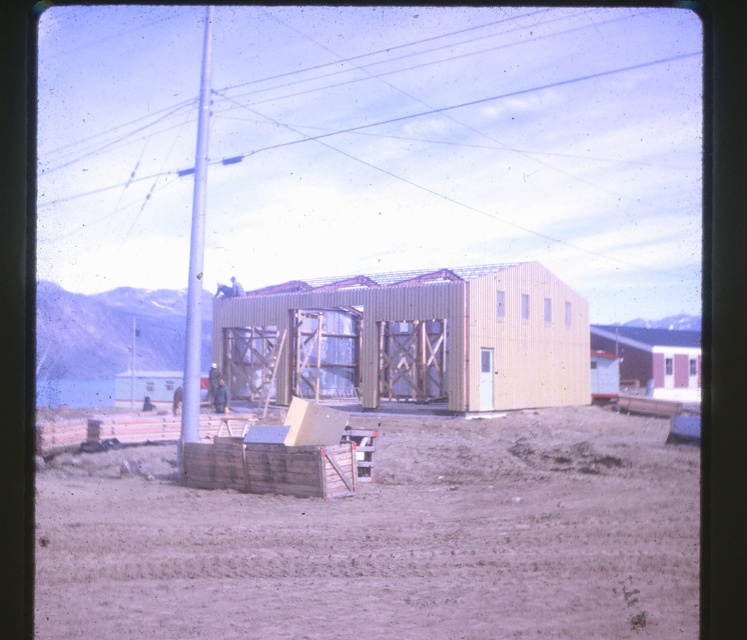
Question: Can you confirm if light brown corrugated metal hut at center is wider than metallic pole at center-left?

Choices:
 (A) no
 (B) yes

Answer: (B)

Question: Which point is closer to the camera taking this photo?

Choices:
 (A) (483, 410)
 (B) (207, 132)

Answer: (A)

Question: Which point is farther to the camera?

Choices:
 (A) brown sandy dirt at lower center
 (B) metallic pole at center-left
 (C) wooden cabin at center
 (D) light brown corrugated metal hut at center

Answer: (D)

Question: Is wooden cabin at center positioned behind light brown corrugated metal hut at center?

Choices:
 (A) yes
 (B) no

Answer: (B)

Question: Which point is closer to the camera taking this photo?

Choices:
 (A) (459, 285)
 (B) (187, 579)
 (C) (633, 348)
 (D) (201, 285)

Answer: (B)

Question: Does brown sandy dirt at lower center appear on the right side of light brown corrugated metal hut at center?

Choices:
 (A) yes
 (B) no

Answer: (B)